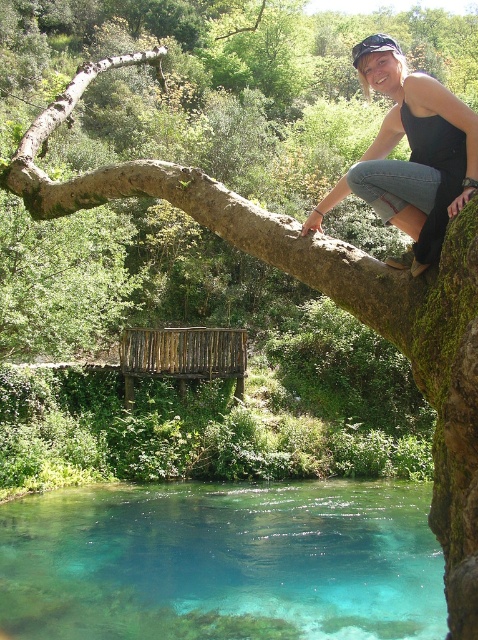
You are a photographer trying to capture the woman on the tree branch. The point at coordinates (223, 563) is on clear glassy water at lower center. Where should you position your camera to ensure the reflection of the woman is visible in the water?

To capture the reflection of the woman on the tree branch in the clear glassy water at lower center, position your camera directly above the point at coordinates (223, 563). Since reflections are best viewed when the camera is at the same angle as the light reflecting off the water surface, aligning the camera above this point ensures the reflection of the woman will be visible in the clear glassy water at lower center.

You are planning to jump into the water from the branch where the woman is sitting. Considering the clear glassy water at lower center and the black denim jeans at upper right, which one is wider in terms of their visual representation in the image?

The clear glassy water at lower center is wider than the black denim jeans at upper right according to the description provided.